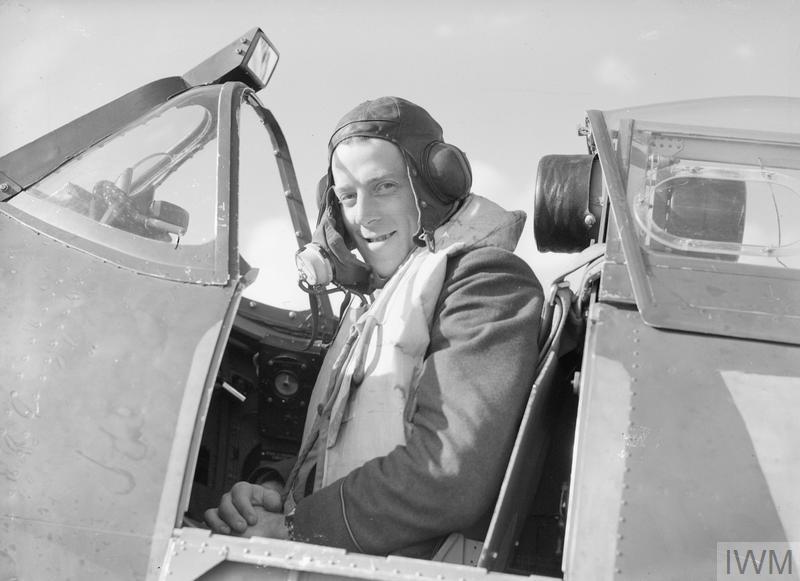
The height and width of the screenshot is (581, 800). What are the coordinates of `headrest` in the screenshot? It's located at (566, 192).